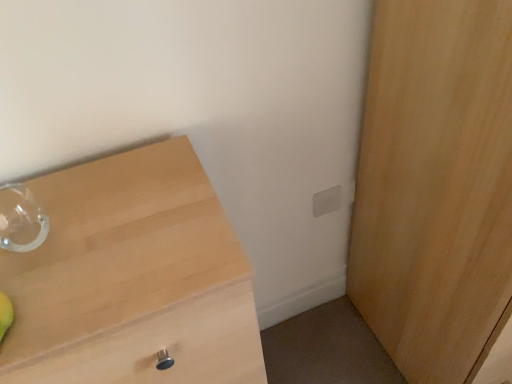
The width and height of the screenshot is (512, 384). I want to click on empty space that is ontop of light wood chest of drawers at left (from a real-world perspective), so click(x=90, y=224).